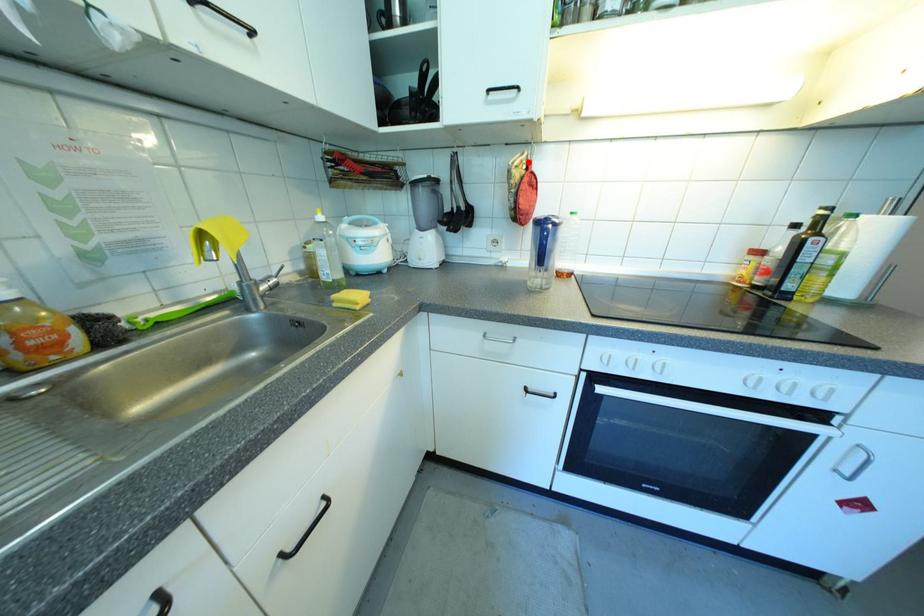
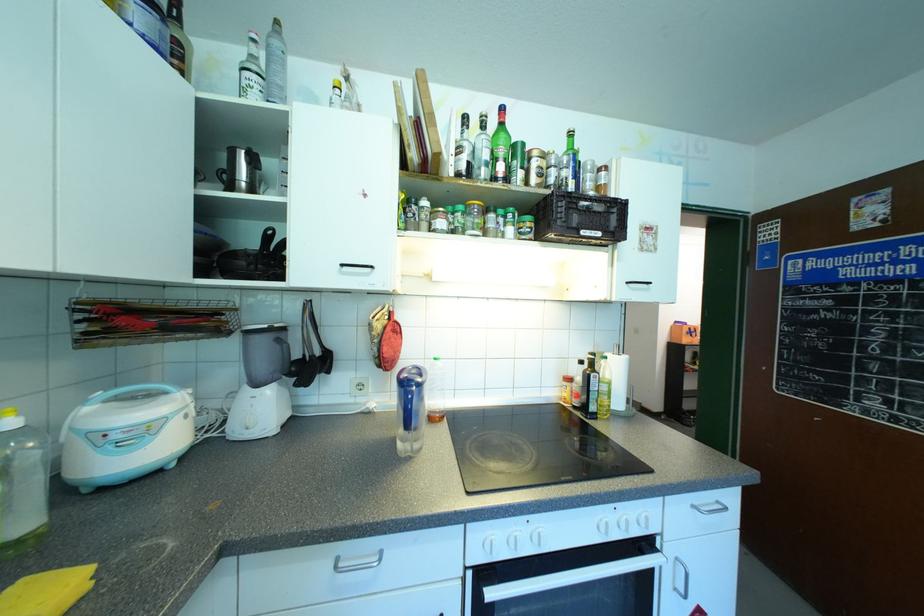
Find the pixel in the second image that matches the highlighted location in the first image.

(390, 313)